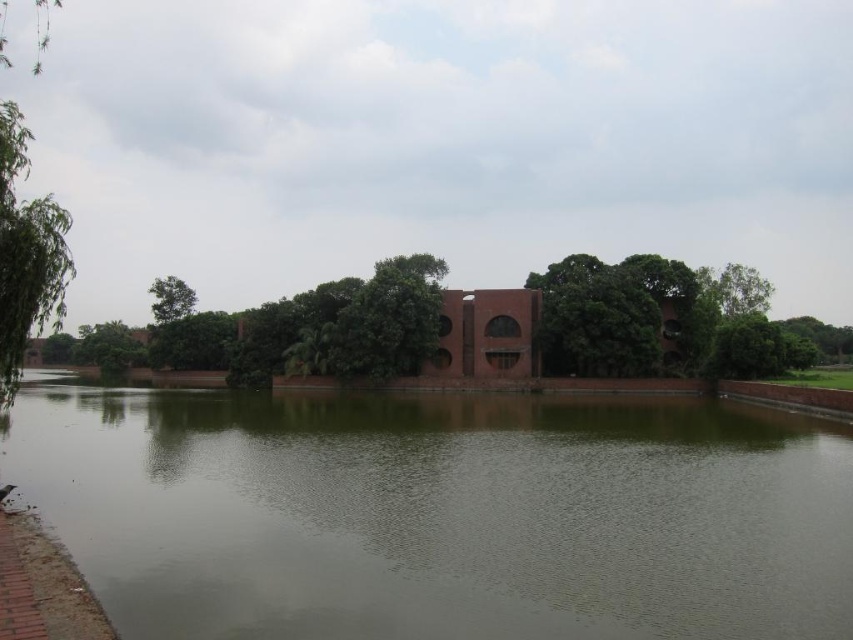
Question: Which is nearer to the green leafy tree at upper right?

Choices:
 (A) brown matte lake at center
 (B) green leafy tree at upper left
 (C) green leafy tree at center

Answer: (A)

Question: Which of these objects is positioned closest to the green leafy tree at left?

Choices:
 (A) green leafy tree at upper left
 (B) green leafy tree at center

Answer: (A)

Question: Is brown matte lake at center bigger than green leafy tree at left?

Choices:
 (A) no
 (B) yes

Answer: (A)

Question: Does green leafy tree at center have a greater width compared to green leafy tree at upper left?

Choices:
 (A) no
 (B) yes

Answer: (B)

Question: Can you confirm if green leafy tree at center is positioned above green leafy tree at upper left?

Choices:
 (A) no
 (B) yes

Answer: (A)

Question: Which point is closer to the camera taking this photo?

Choices:
 (A) (117, 365)
 (B) (164, 321)
 (C) (728, 272)
 (D) (285, 465)

Answer: (D)